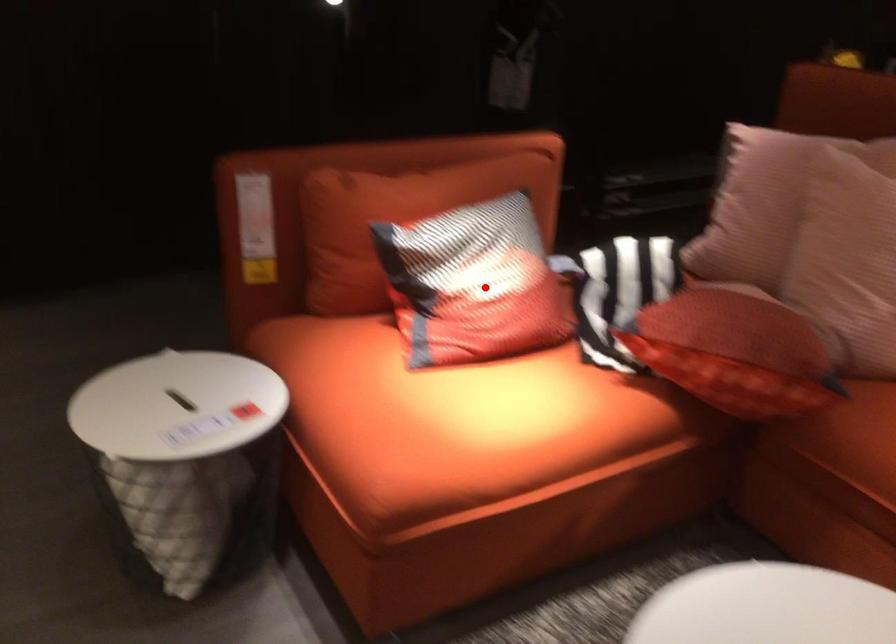
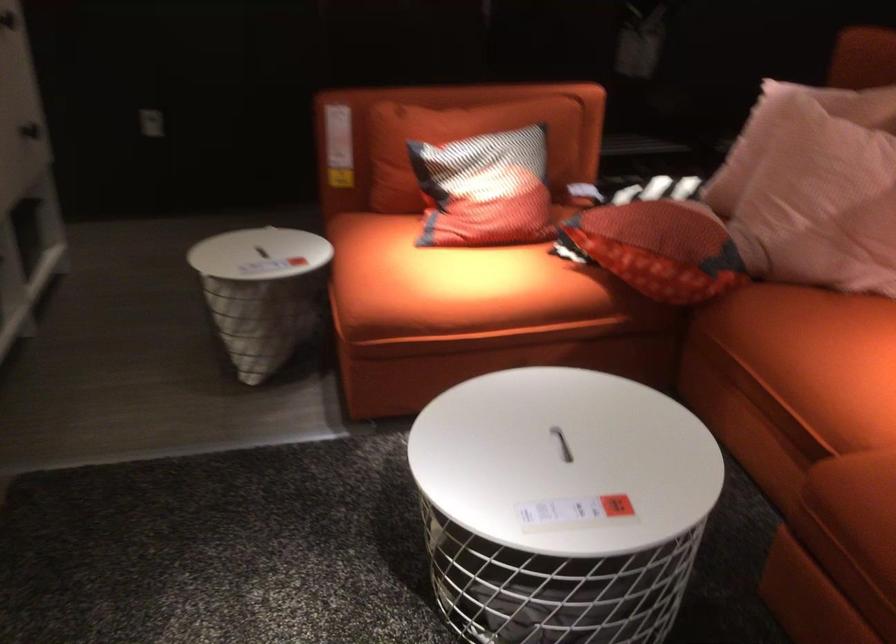
Question: I am providing you with two images of the same scene from different viewpoints. In image1, a red point is highlighted. Considering the same 3D point in image2, which of the following is correct?

Choices:
 (A) It is closer
 (B) It is farther

Answer: (B)